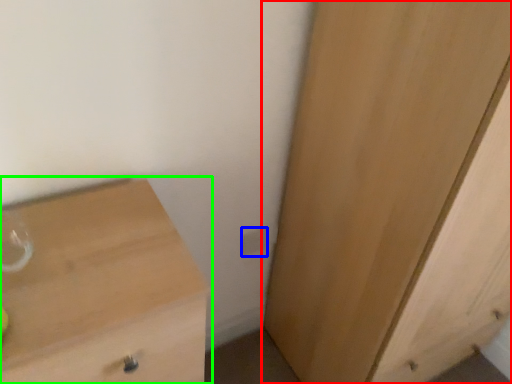
Question: Estimate the real-world distances between objects in this image. Which object is farther from cupboard (highlighted by a red box), electric outlet (highlighted by a blue box) or chest of drawers (highlighted by a green box)?

Choices:
 (A) electric outlet
 (B) chest of drawers

Answer: (B)